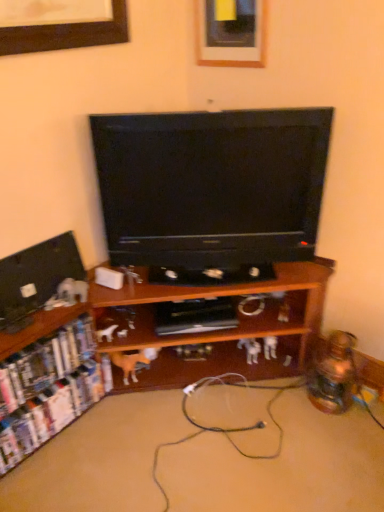
The width and height of the screenshot is (384, 512). What are the coordinates of `free location in front of black rubber extension cord at lower center` in the screenshot? It's located at (188, 425).